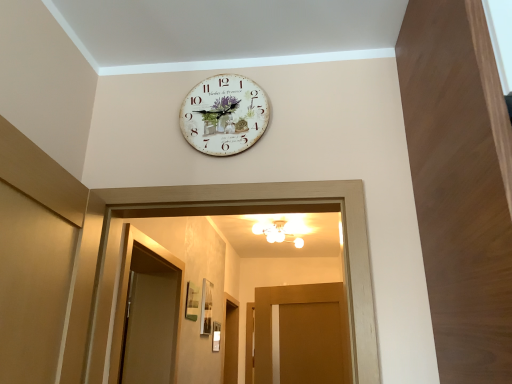
Question: Considering their positions, is white glossy chandelier at upper center located in front of or behind matte wood door at center?

Choices:
 (A) front
 (B) behind

Answer: (B)

Question: Visually, is white glossy chandelier at upper center positioned to the left or to the right of matte wood door at center?

Choices:
 (A) right
 (B) left

Answer: (B)

Question: Which object is the farthest from the white glossy chandelier at upper center?

Choices:
 (A) matte wood door at center
 (B) white painted wood clock at upper center

Answer: (B)

Question: Which object is the farthest from the white glossy chandelier at upper center?

Choices:
 (A) matte wood door at center
 (B) white painted wood clock at upper center

Answer: (B)